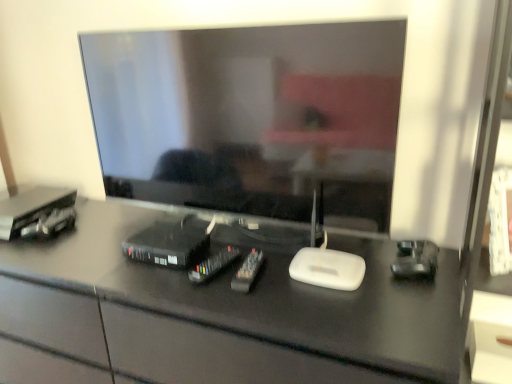
Identify the location of free point in front of black plastic remote control at center, the second equipment viewed from the right. (224, 301).